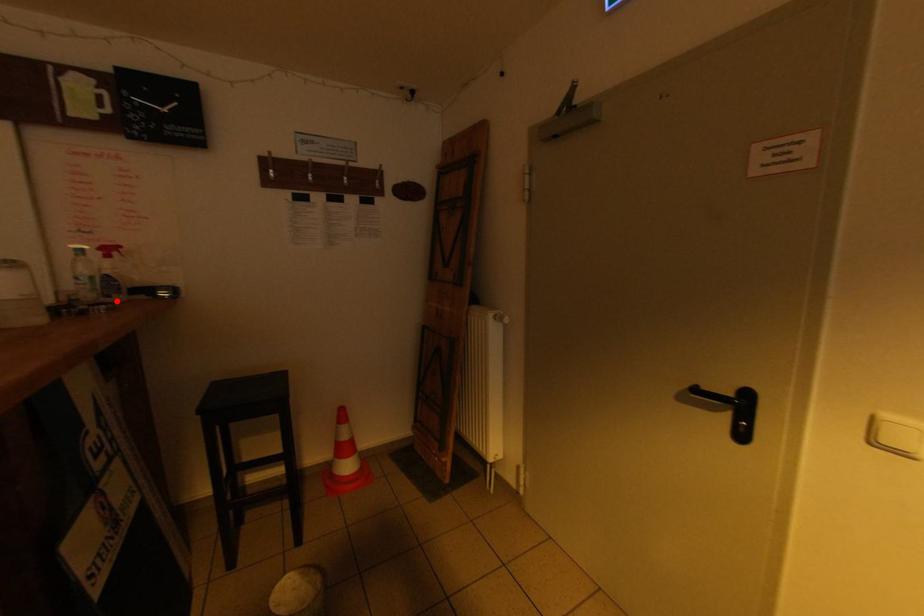
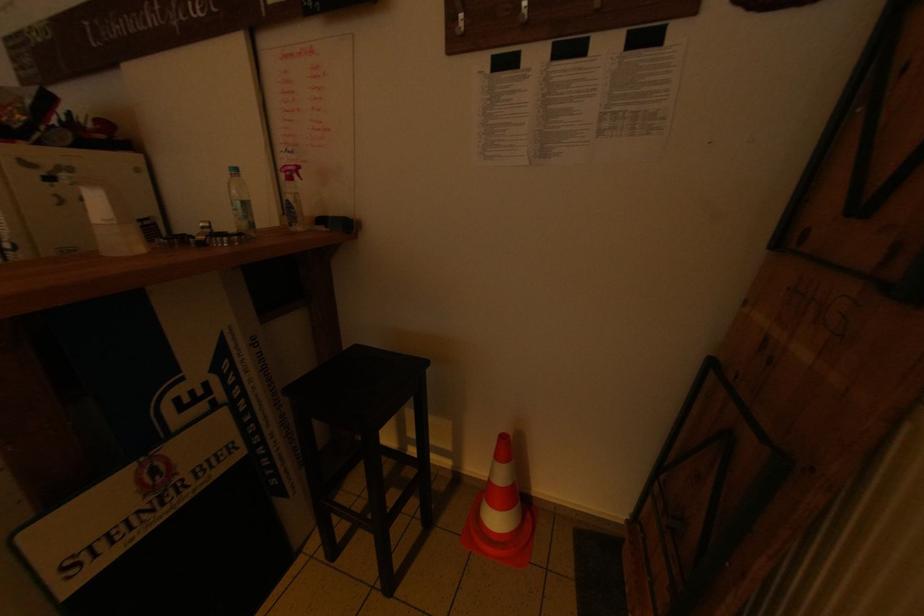
Locate, in the second image, the point that corresponds to the highlighted location in the first image.

(300, 229)